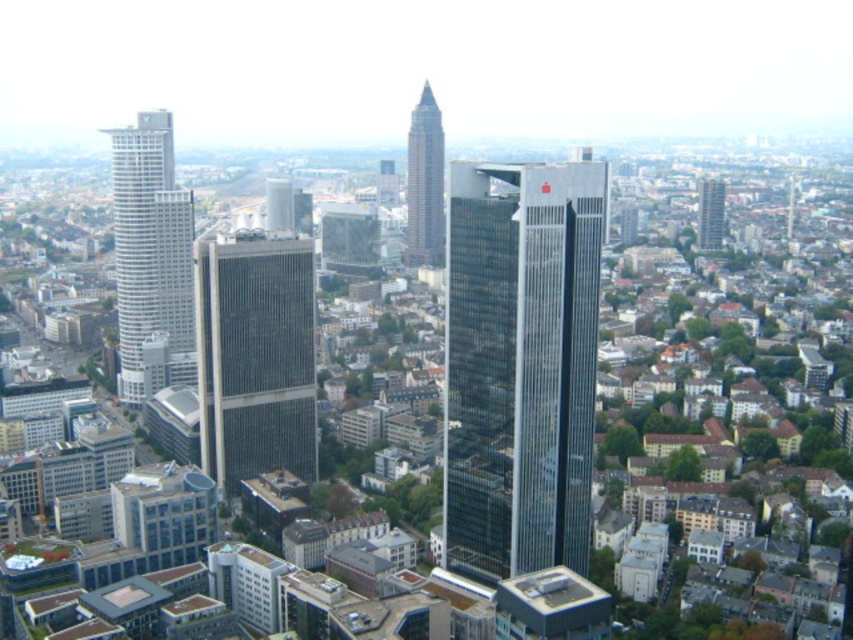
Question: Is the position of glassy steel skyscraper at center less distant than that of smooth glass skyscraper at center?

Choices:
 (A) no
 (B) yes

Answer: (B)

Question: Does glassy steel skyscraper at center have a larger size compared to dark gray glass skyscraper at center?

Choices:
 (A) yes
 (B) no

Answer: (A)

Question: Does smooth glass skyscraper at center have a greater width compared to glassy reflective skyscraper at right?

Choices:
 (A) yes
 (B) no

Answer: (B)

Question: Based on their relative distances, which object is nearer to the white glass skyscraper at left?

Choices:
 (A) glassy reflective skyscraper at right
 (B) dark gray glass skyscraper at center
 (C) smooth glass skyscraper at center
 (D) glassy steel skyscraper at center

Answer: (B)

Question: Which point is closer to the camera taking this photo?

Choices:
 (A) (129, 177)
 (B) (706, 209)
 (C) (509, 452)
 (D) (434, 164)

Answer: (C)

Question: Considering the real-world distances, which object is closest to the glassy steel skyscraper at center?

Choices:
 (A) dark gray glass skyscraper at center
 (B) white glass skyscraper at left
 (C) glassy reflective skyscraper at right
 (D) smooth glass skyscraper at center

Answer: (A)